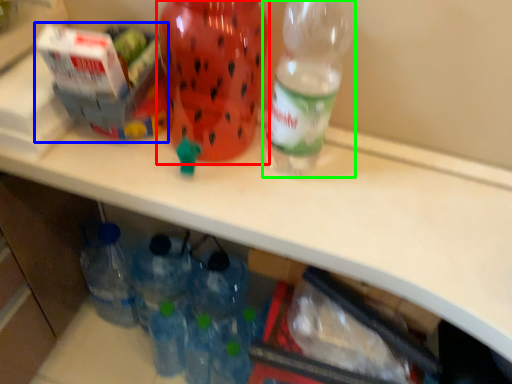
Question: Considering the real-world distances, which object is farthest from bottle (highlighted by a red box)? box (highlighted by a blue box) or bottle (highlighted by a green box)?

Choices:
 (A) box
 (B) bottle

Answer: (B)